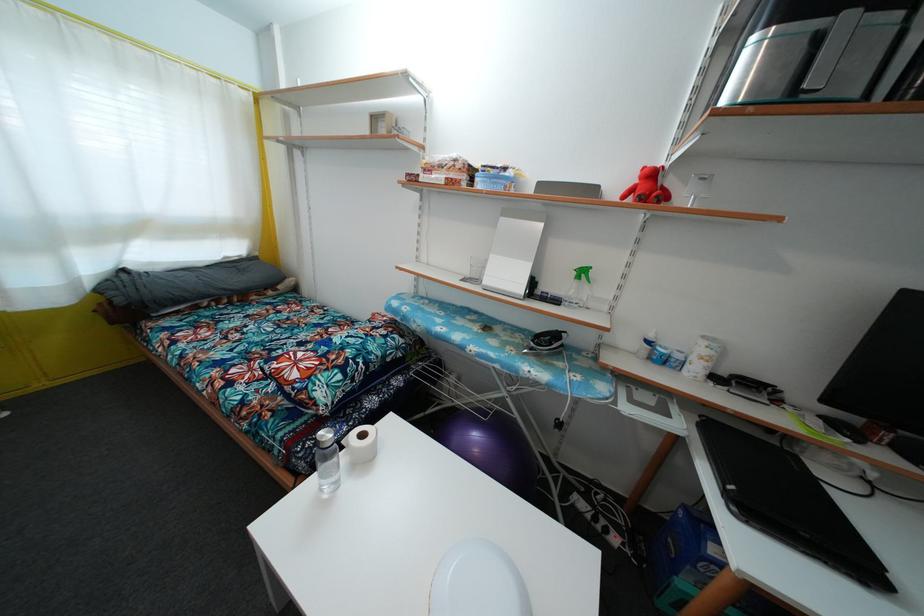
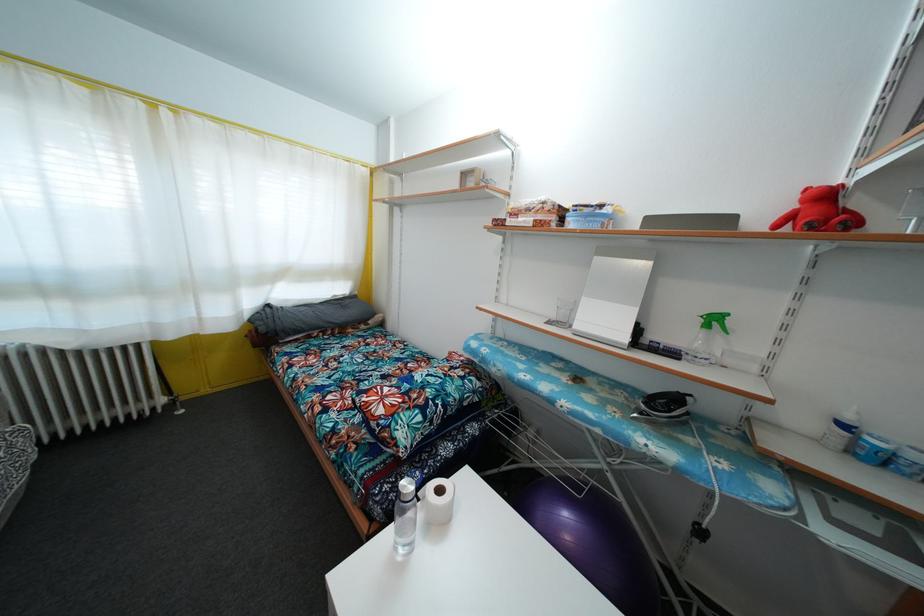
Locate, in the second image, the point that corresponds to point 367,442 in the first image.

(444, 498)